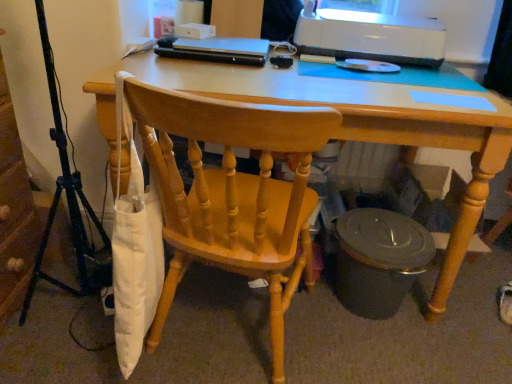
Question: Considering the positions of matte black trash can at lower right and wooden chair at center in the image, is matte black trash can at lower right wider or thinner than wooden chair at center?

Choices:
 (A) thin
 (B) wide

Answer: (A)

Question: Considering the positions of point (414, 248) and point (281, 114), is point (414, 248) closer or farther from the camera than point (281, 114)?

Choices:
 (A) closer
 (B) farther

Answer: (B)

Question: Estimate the real-world distances between objects in this image. Which object is farther from the white glossy printer at upper right?

Choices:
 (A) light wood desk at center
 (B) matte black trash can at lower right
 (C) wooden chair at center
 (D) metallic tripod at left

Answer: (D)

Question: Considering the real-world distances, which object is closest to the wooden chair at center?

Choices:
 (A) light wood desk at center
 (B) white glossy printer at upper right
 (C) matte black trash can at lower right
 (D) metallic tripod at left

Answer: (A)